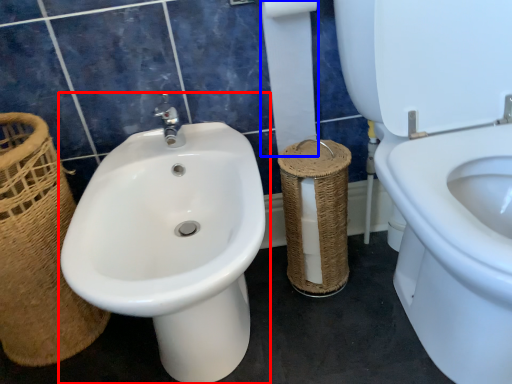
Question: Which of the following is the farthest to the observer, sink (highlighted by a red box) or toilet paper (highlighted by a blue box)?

Choices:
 (A) sink
 (B) toilet paper

Answer: (B)